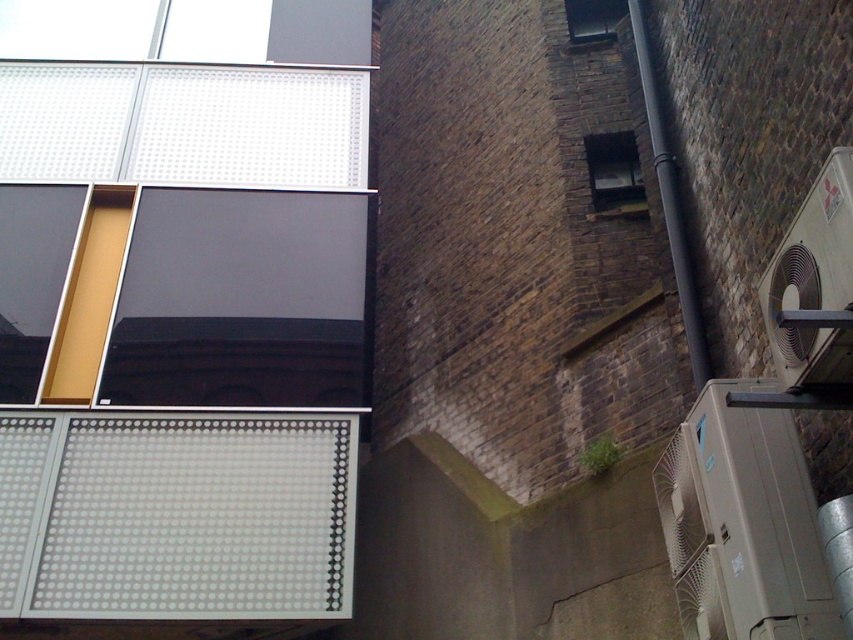
Question: Does clear glass window at upper right appear on the left side of matte black window at upper center?

Choices:
 (A) no
 (B) yes

Answer: (A)

Question: Is clear glass window at upper right smaller than matte black window at upper center?

Choices:
 (A) yes
 (B) no

Answer: (B)

Question: Does clear glass window at upper right have a smaller size compared to matte black window at upper center?

Choices:
 (A) no
 (B) yes

Answer: (A)

Question: Among these points, which one is farthest from the camera?

Choices:
 (A) [589, 136]
 (B) [590, 10]

Answer: (B)